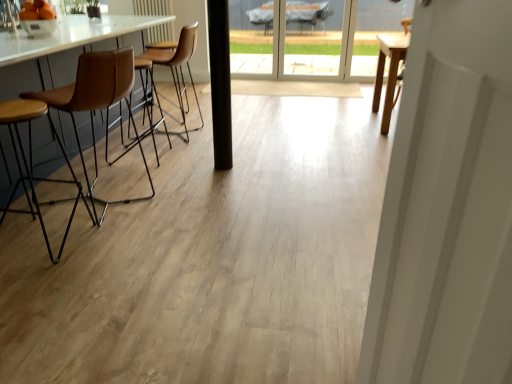
The width and height of the screenshot is (512, 384). Identify the location of vacant area that lies in front of brown leather stool at left, positioned as the second chair in front-to-back order. (x=110, y=247).